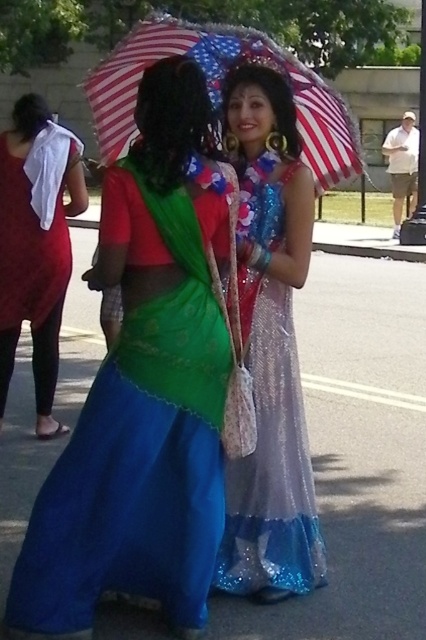
From the picture: Is shiny green fabric at center wider than american flag fabric umbrella at upper center?

Incorrect, shiny green fabric at center's width does not surpass american flag fabric umbrella at upper center's.

Can you confirm if shiny green fabric at center is taller than american flag fabric umbrella at upper center?

No.

Which is in front, point (92, 403) or point (311, 147)?

Positioned in front is point (92, 403).

The image size is (426, 640). In order to click on shiny green fabric at center in this screenshot , I will do `click(143, 390)`.

Can you confirm if shiny green fabric at center is wider than matte red dress at left?

Correct, the width of shiny green fabric at center exceeds that of matte red dress at left.

Can you confirm if shiny green fabric at center is thinner than matte red dress at left?

No, shiny green fabric at center is not thinner than matte red dress at left.

Does point (193, 595) come farther from viewer compared to point (34, 125)?

That is False.

Where is `shiny green fabric at center`? shiny green fabric at center is located at coordinates (143, 390).

Who is positioned more to the right, sparkly silver dress at center or matte red dress at left?

From the viewer's perspective, sparkly silver dress at center appears more on the right side.

In the scene shown: Between sparkly silver dress at center and matte red dress at left, which one is positioned lower?

Positioned lower is sparkly silver dress at center.

Between point (316, 518) and point (46, 112), which one is positioned behind?

Positioned behind is point (46, 112).

Where is `sparkly silver dress at center`? sparkly silver dress at center is located at coordinates (270, 348).